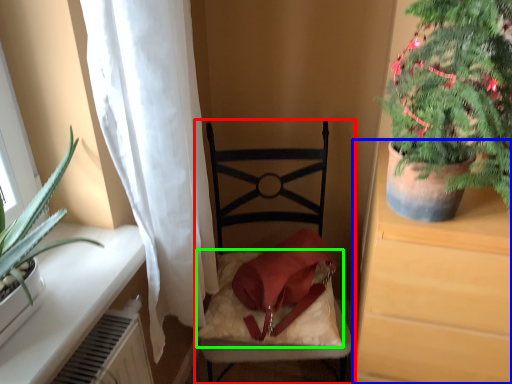
Question: Which object is the closest to the chair (highlighted by a red box)? Choose among these: cabinetry (highlighted by a blue box) or pillow (highlighted by a green box).

Choices:
 (A) cabinetry
 (B) pillow

Answer: (B)